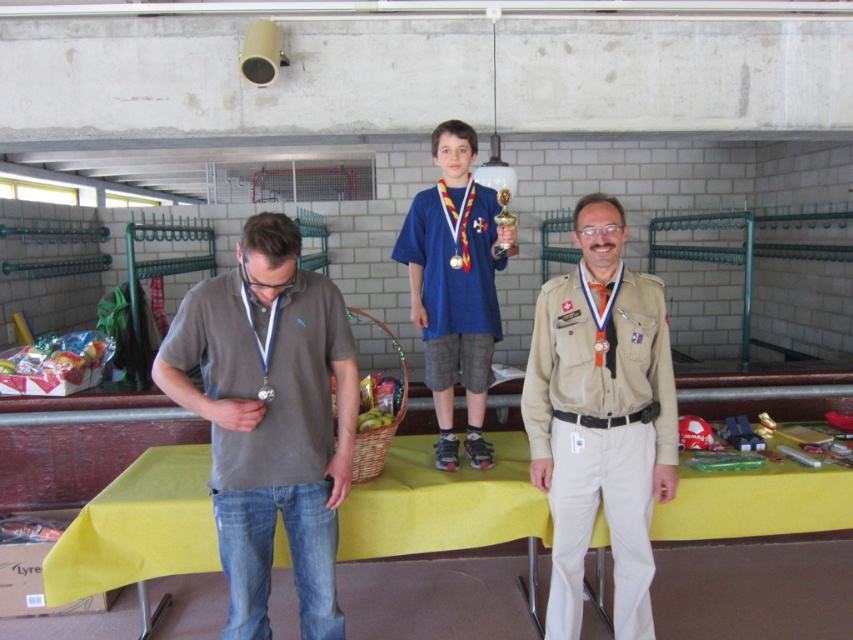
Question: Does tan uniform at center come in front of blue fabric shirt at center?

Choices:
 (A) no
 (B) yes

Answer: (B)

Question: Can you confirm if tan uniform at center is thinner than gold metallic trophy at center?

Choices:
 (A) yes
 (B) no

Answer: (B)

Question: Which of the following is the closest to the observer?

Choices:
 (A) (456, 260)
 (B) (305, 561)
 (C) (799, 499)

Answer: (B)

Question: Does blue fabric shirt at center have a lesser width compared to metallic gold medal at center?

Choices:
 (A) no
 (B) yes

Answer: (A)

Question: Among these points, which one is farthest from the camera?

Choices:
 (A) (212, 436)
 (B) (263, 397)
 (C) (434, 529)

Answer: (C)

Question: Considering the real-world distances, which object is closest to the gold metallic trophy at center?

Choices:
 (A) blue fabric shirt at center
 (B) metallic gold medal at center
 (C) metallic silver medal at center
 (D) tan uniform at center

Answer: (C)